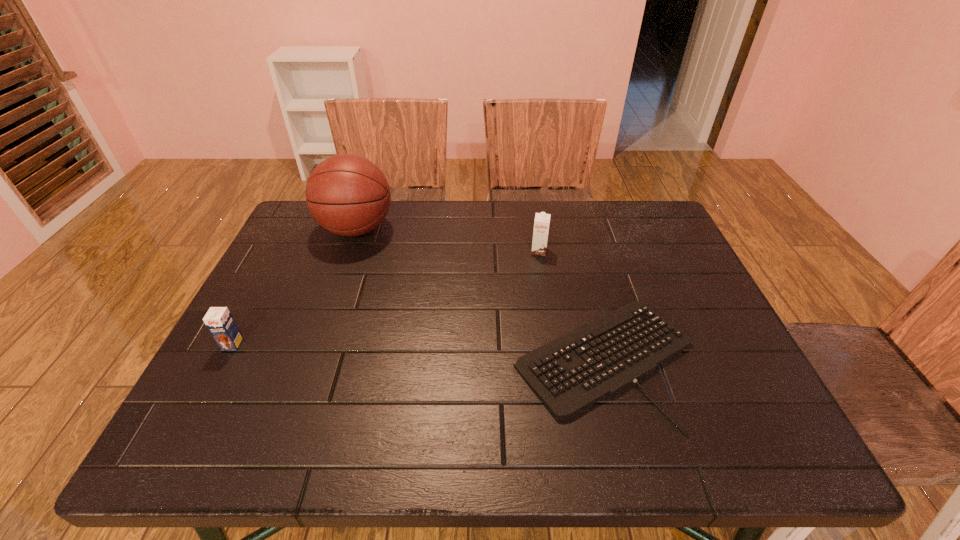
The width and height of the screenshot is (960, 540). I want to click on the third object from right to left, so click(x=348, y=195).

The height and width of the screenshot is (540, 960). What are the coordinates of `the tallest object` in the screenshot? It's located at (348, 195).

Locate an element on the screen. the farther chocolate milk is located at coordinates (541, 224).

This screenshot has width=960, height=540. I want to click on the leftmost object, so pyautogui.click(x=219, y=321).

Find the location of a particular element. the nearer chocolate milk is located at coordinates (219, 321).

At what (x,y) coordinates should I click in order to perform the action: click on computer keyboard. Please return your answer as a coordinate pair (x, y). Image resolution: width=960 pixels, height=540 pixels. Looking at the image, I should click on (569, 374).

This screenshot has width=960, height=540. Find the location of `vacant area located 0.270m on the front of the third object from right to left`. vacant area located 0.270m on the front of the third object from right to left is located at coordinates (323, 325).

In order to click on vacant space located 0.320m on the left of the right chocolate milk in this screenshot , I will do `click(418, 251)`.

This screenshot has height=540, width=960. In order to click on free location located 0.210m on the front label of the nearer chocolate milk in this screenshot , I will do `click(182, 439)`.

Find the location of `free point located on the back of the shortest object`. free point located on the back of the shortest object is located at coordinates (580, 266).